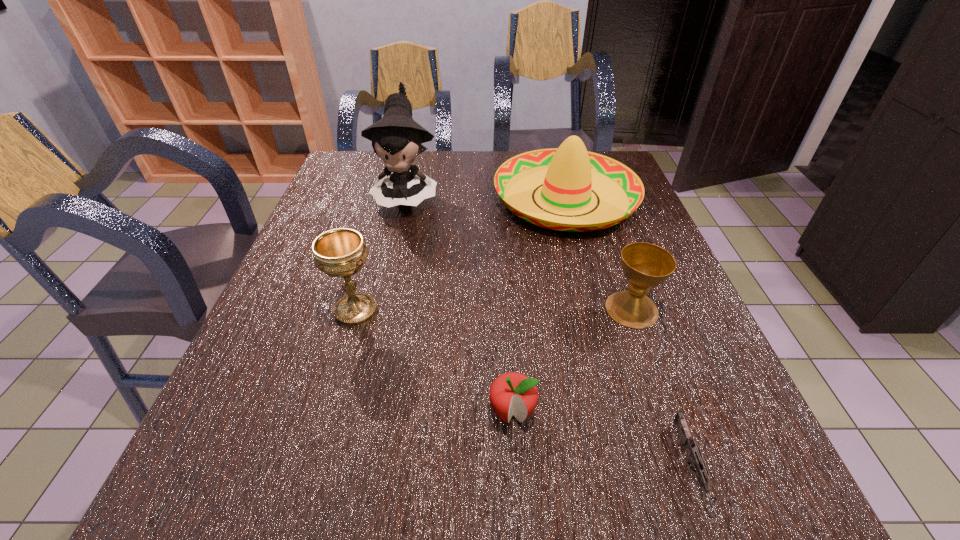
Identify the location of unoccupied area between the left chalice and the sombrero. (x=461, y=254).

Where is `vacant region between the sombrero and the tallest object`? This screenshot has height=540, width=960. vacant region between the sombrero and the tallest object is located at coordinates (486, 197).

This screenshot has width=960, height=540. I want to click on unoccupied position between the sombrero and the fifth tallest object, so click(539, 305).

This screenshot has height=540, width=960. Find the location of `empty location between the sombrero and the gun`. empty location between the sombrero and the gun is located at coordinates (629, 335).

In order to click on free point between the shortest object and the fifth tallest object in this screenshot , I will do pos(602,442).

The height and width of the screenshot is (540, 960). I want to click on free space between the tallest object and the gun, so click(549, 333).

You are a GUI agent. You are given a task and a screenshot of the screen. Output one action in this format:
    pyautogui.click(x=<x>, y=<y>)
    Task: Click on the free spot between the fourth tallest object and the taller chalice
    The image size is (960, 540).
    Given the screenshot: What is the action you would take?
    pyautogui.click(x=493, y=310)

This screenshot has width=960, height=540. I want to click on object that stands as the fifth closest to the sombrero, so click(695, 457).

Find the location of `object that can be found as the fourth closest to the left chalice`. object that can be found as the fourth closest to the left chalice is located at coordinates (645, 265).

Find the location of a particular element. The height and width of the screenshot is (540, 960). vacant space that satisfies the following two spatial constraints: 1. at the face of the doll; 2. on the right side of the shorter chalice is located at coordinates (380, 309).